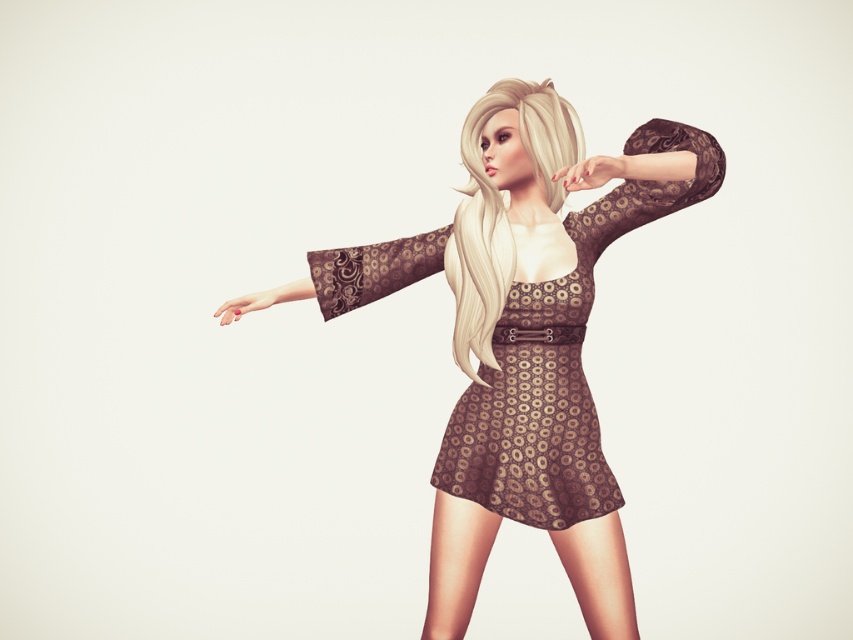
You are a fashion designer observing the image of a person wearing a dress with a brown lace sleeve at upper center and a matte brown hand at upper center. Which object is larger in size?

The brown lace sleeve at upper center is bigger than the matte brown hand at upper center.

You are a fashion designer working on a new collection. You have a brown textured dress at center and a brown lace sleeve at center. If you want to place them side by side on a mannequin, will there be enough space between them to fit a 15 cm wide accessory? Please explain your reasoning.

The brown textured dress at center is 18.18 centimeters away from the brown lace sleeve at center. Since the distance between them is greater than 15 cm, there is enough space to fit a 15 cm wide accessory between them.

You are a photographer standing at a specific position. You want to take a photo of the brown textured dress at center. What is the minimum distance you need to move forward to ensure the dress fills the frame properly, considering the camera requires the subject to be at least 1.5 meters away for optimal focus?

The brown textured dress at center is currently 1.61 meters away from the viewer. Since the camera requires the subject to be at least 1.5 meters away, you can move forward by 0.11 meters to maintain the required distance while ensuring the dress fills the frame properly.